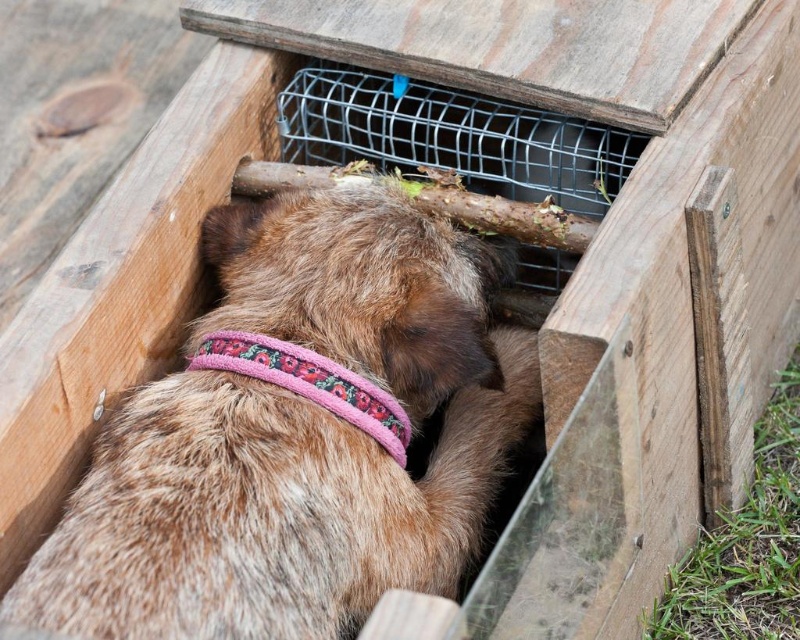
Which is below, brown furry dog at center or pink fabric neckband at center?

brown furry dog at center is below.

Between point (200, 560) and point (370, 429), which one is positioned behind?

The point (370, 429) is behind.

Where is `brown furry dog at center`? brown furry dog at center is located at coordinates (297, 435).